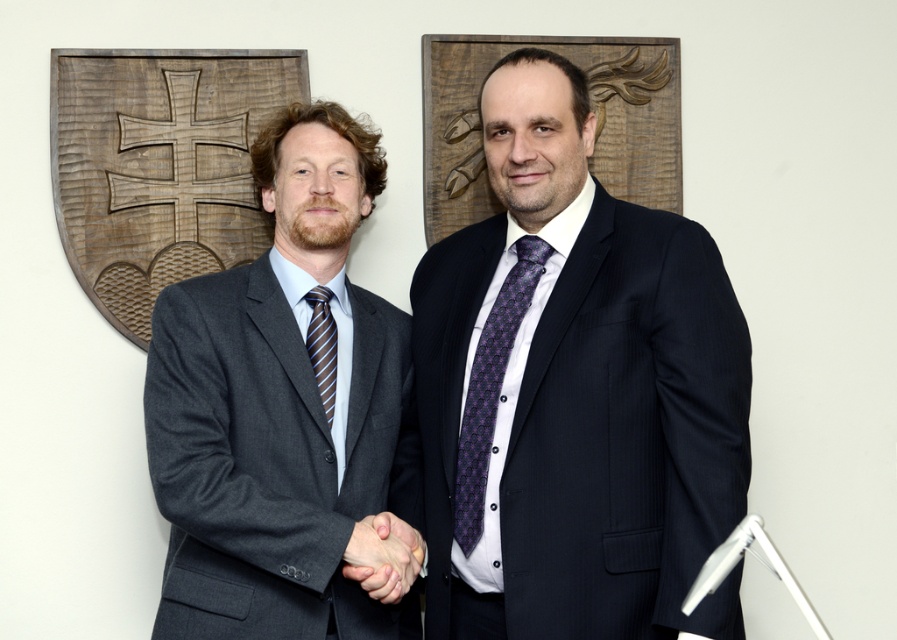
Which is in front, point (464, 556) or point (356, 552)?

Point (356, 552) is more forward.

Is purple printed tie at center bigger than smooth skin handshake at center?

Correct, purple printed tie at center is larger in size than smooth skin handshake at center.

Does point (484, 426) lie behind point (397, 582)?

Yes, it is.

In order to click on purple printed tie at center in this screenshot , I will do `click(490, 387)`.

Does matte black suit at center appear under striped silk tie at center?

No, matte black suit at center is not below striped silk tie at center.

Measure the distance between matte black suit at center and striped silk tie at center.

A distance of 15.15 inches exists between matte black suit at center and striped silk tie at center.

Which is in front, point (536, 529) or point (315, 333)?

Positioned in front is point (536, 529).

The image size is (897, 640). In order to click on matte black suit at center in this screenshot , I will do `click(573, 392)`.

Is point (272, 422) farther from camera compared to point (333, 388)?

No.

Can you confirm if matte gray suit at left is positioned above striped silk tie at center?

Indeed, matte gray suit at left is positioned over striped silk tie at center.

Is point (361, 465) farther from viewer compared to point (328, 316)?

No.

Locate an element on the screen. matte gray suit at left is located at coordinates (286, 417).